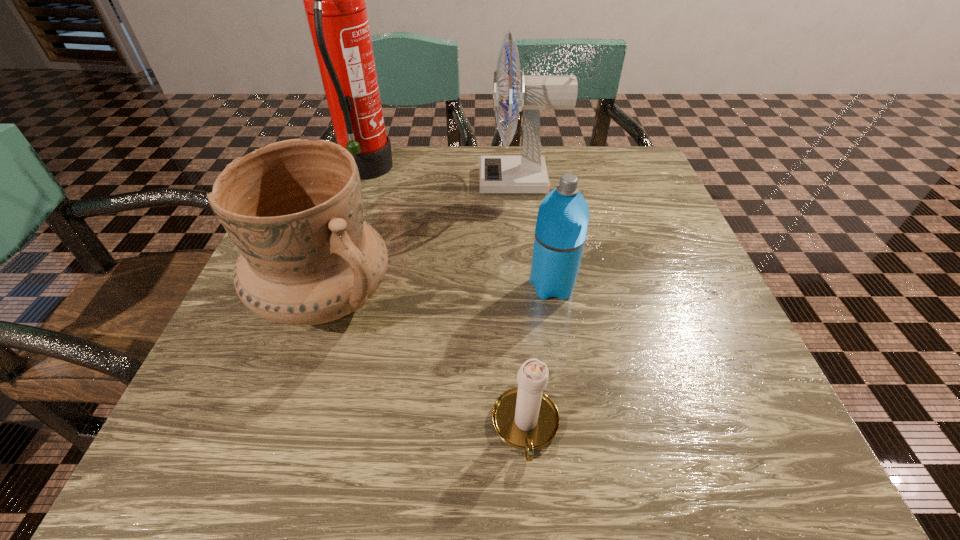
Identify the location of free location located 0.060m on the back of the pottery. The height and width of the screenshot is (540, 960). [347, 232].

Locate an element on the screen. This screenshot has height=540, width=960. free space located on the front of the thermos bottle is located at coordinates (574, 421).

Image resolution: width=960 pixels, height=540 pixels. Find the location of `fire extinguisher located in the far edge section of the desktop`. fire extinguisher located in the far edge section of the desktop is located at coordinates click(334, 0).

Image resolution: width=960 pixels, height=540 pixels. What are the coordinates of `fan present at the far edge` in the screenshot? It's located at (526, 174).

I want to click on object positioned at the near edge, so click(x=524, y=417).

The image size is (960, 540). Identify the location of fire extinguisher present at the left edge. (334, 0).

Identify the location of pottery positioned at the left edge. (294, 209).

You are a GUI agent. You are given a task and a screenshot of the screen. Output one action in this format:
    pyautogui.click(x=<x>, y=<y>)
    Task: Click on the object that is at the far left corner
    Image resolution: width=960 pixels, height=540 pixels.
    Given the screenshot: What is the action you would take?
    pyautogui.click(x=334, y=0)

Where is `free space at the far edge of the desktop`? Image resolution: width=960 pixels, height=540 pixels. free space at the far edge of the desktop is located at coordinates (438, 156).

Where is `free location at the near edge`? The width and height of the screenshot is (960, 540). free location at the near edge is located at coordinates (404, 453).